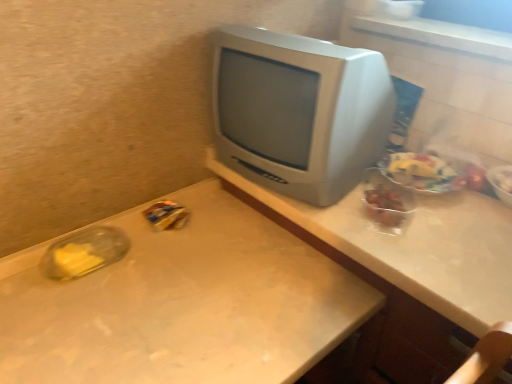
I want to click on vacant space to the right of translucent plastic container at right, which is counted as the third food, starting from the right, so pyautogui.click(x=455, y=225).